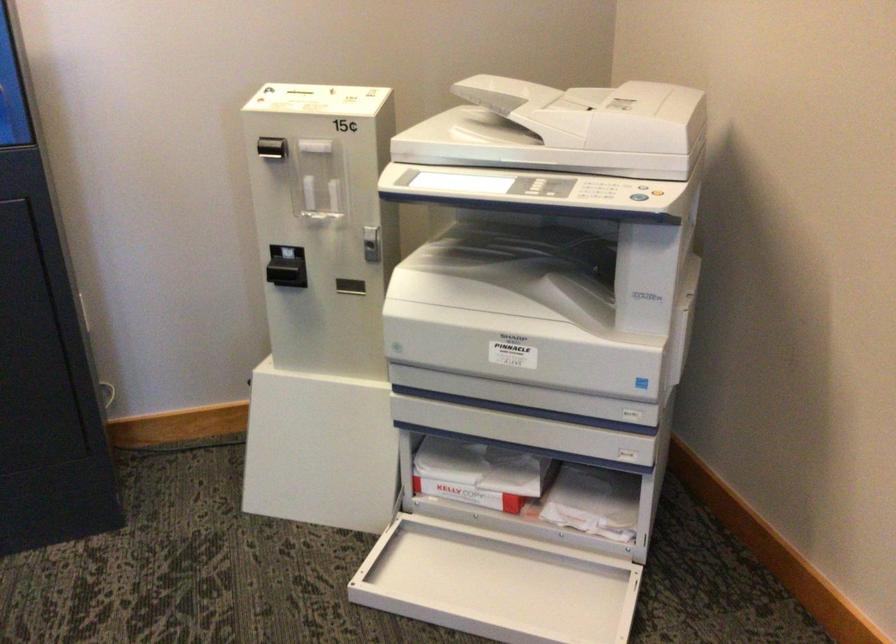
I want to click on open copier drawer, so click(x=531, y=488).